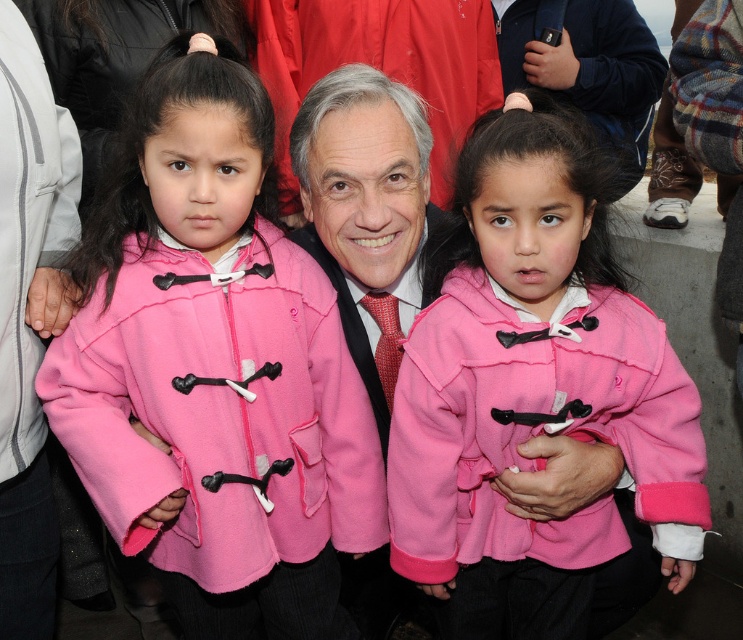
Question: Can you confirm if pink fleece jacket at center is positioned below matte pink jacket at center?

Choices:
 (A) yes
 (B) no

Answer: (A)

Question: Which point appears farthest from the camera in this image?

Choices:
 (A) (389, 358)
 (B) (559, 582)
 (C) (189, 563)

Answer: (A)

Question: Among these points, which one is farthest from the camera?

Choices:
 (A) (398, 324)
 (B) (266, 404)

Answer: (A)

Question: Which of the following is the farthest from the observer?

Choices:
 (A) (108, 260)
 (B) (499, 442)
 (C) (285, 99)

Answer: (C)

Question: Is matte pink coat at left wider than pink fleece jacket at center?

Choices:
 (A) no
 (B) yes

Answer: (B)

Question: Can you confirm if matte pink jacket at center is bigger than polka dot silk tie at center?

Choices:
 (A) no
 (B) yes

Answer: (B)